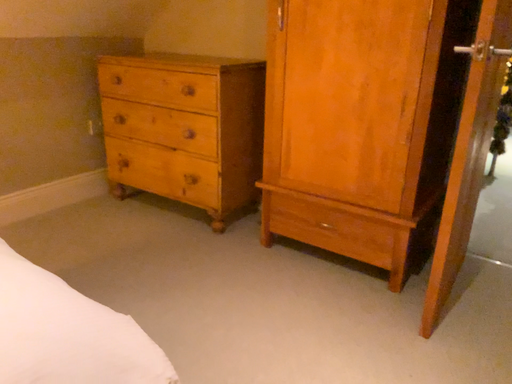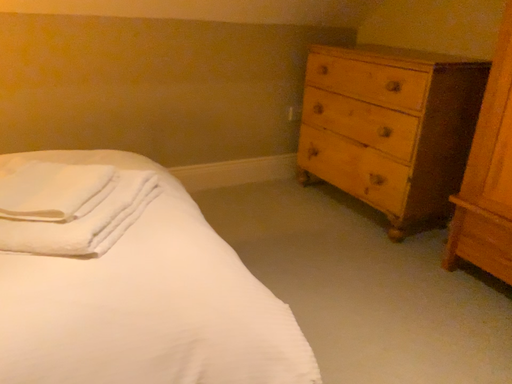
Question: How did the camera likely rotate when shooting the video?

Choices:
 (A) rotated right
 (B) rotated left

Answer: (B)